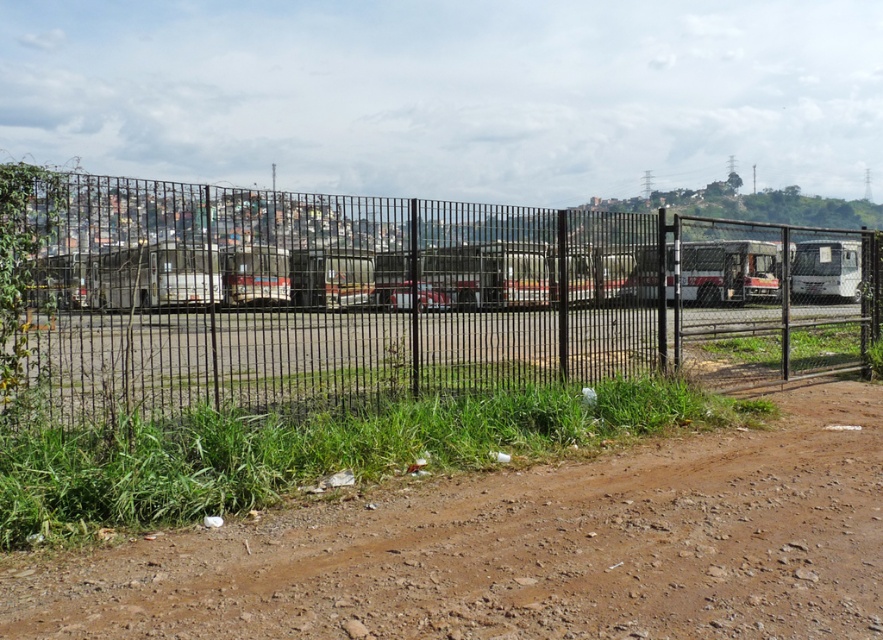
Question: Can you confirm if black metal fence at center is smaller than brown dirt field at lower left?

Choices:
 (A) yes
 (B) no

Answer: (B)

Question: Where is black metal fence at center located in relation to brown dirt field at lower left in the image?

Choices:
 (A) left
 (B) right

Answer: (B)

Question: Does black metal fence at center have a greater width compared to brown dirt field at lower left?

Choices:
 (A) no
 (B) yes

Answer: (B)

Question: Which of the following is the farthest from the observer?

Choices:
 (A) (385, 502)
 (B) (601, 282)

Answer: (B)